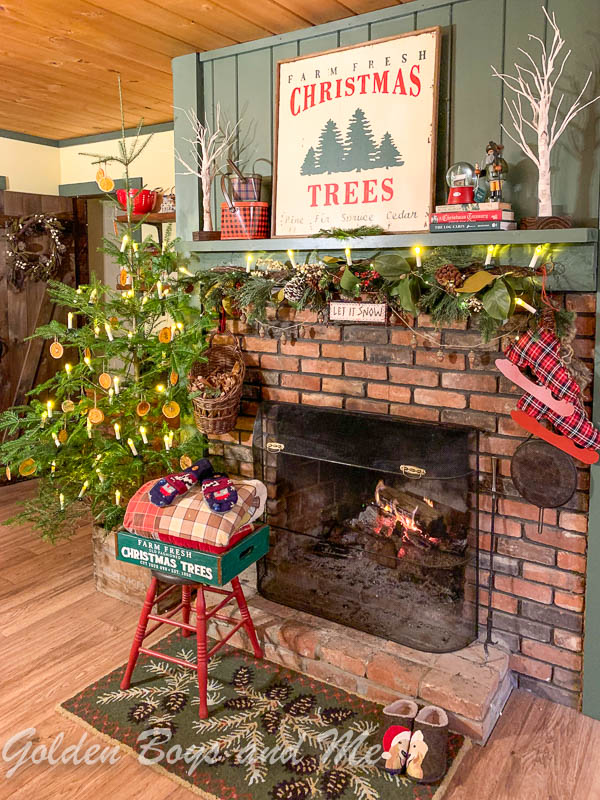
Find the location of `brick surround`. brick surround is located at coordinates (537, 594), (368, 381), (234, 446), (477, 708), (509, 678), (191, 616), (244, 578).